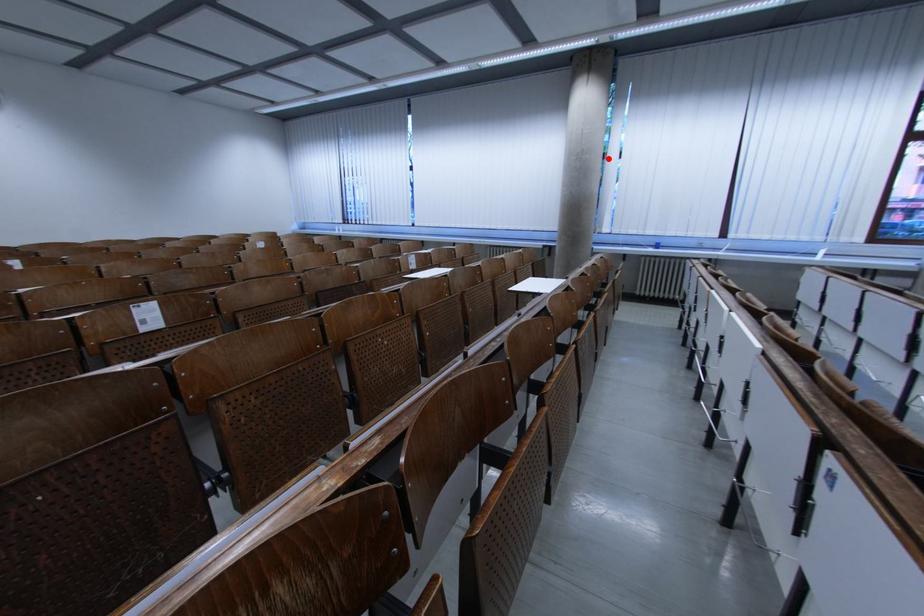
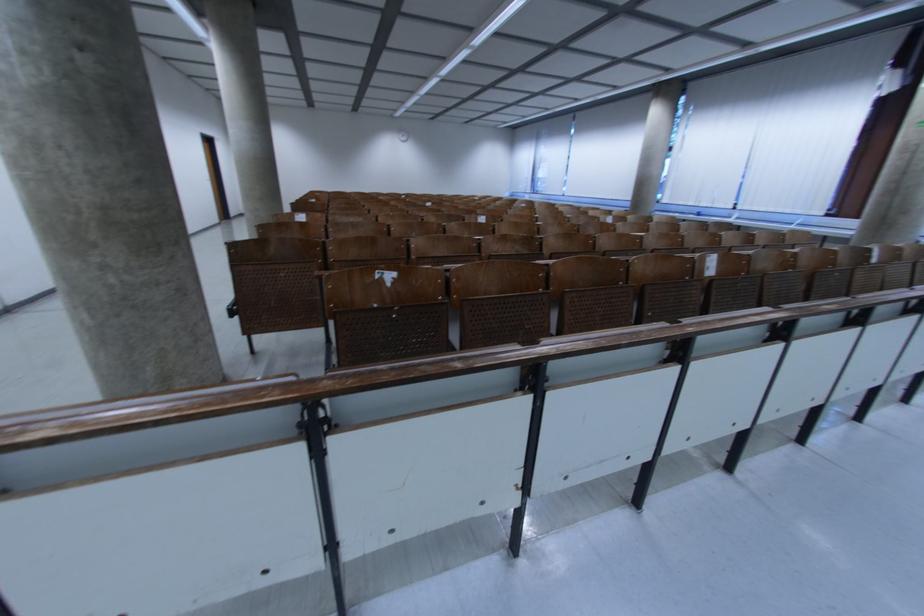
The point at the highlighted location is marked in the first image. Where is the corresponding point in the second image?

(675, 152)